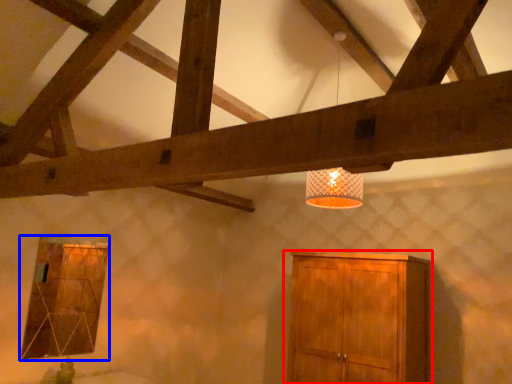
Question: Which point is closer to the camera, cupboard (highlighted by a red box) or window (highlighted by a blue box)?

Choices:
 (A) cupboard
 (B) window

Answer: (A)